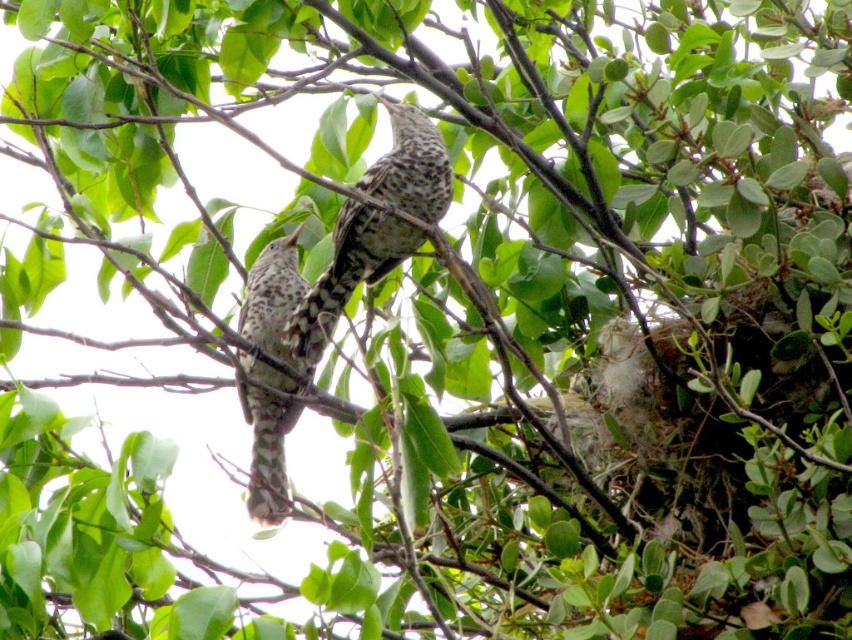
In the scene shown: You are a birdwatcher trying to capture both birds in a single photo. The camera you have can only focus on objects within a 2.5 inch range. Can you fit both speckled feathered bird at center and speckled feathered bird at left in the camera frame?

The speckled feathered bird at center and speckled feathered bird at left are 2.29 inches apart, which is within the camera frame range of 2.5 inches. Therefore, both birds can be captured in a single photo.

You are a birdwatcher observing two speckled feathered birds. You see the speckled feathered bird at center and the speckled feathered bird at left. Which one has a larger size?

The speckled feathered bird at center is bigger than the speckled feathered bird at left according to the description.